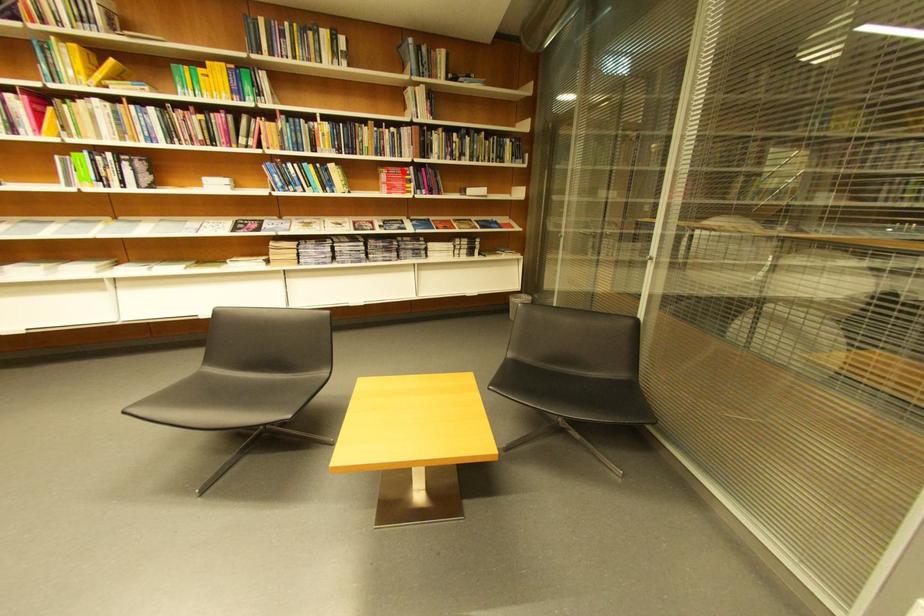
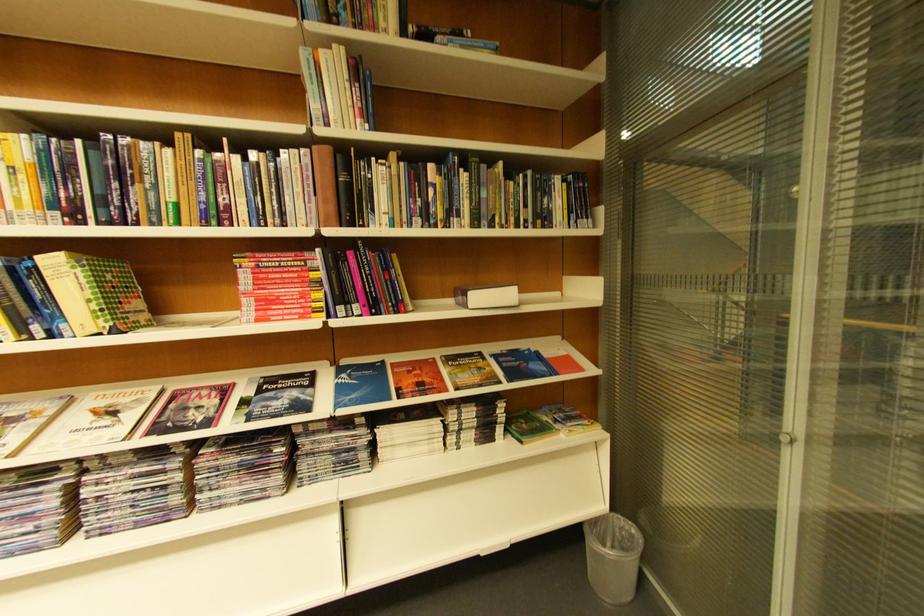
Question: A red point is marked in image1. In image2, is the corresponding 3D point closer to the camera or farther? Reply with the corresponding letter.

Choices:
 (A) The corresponding 3D point is closer.
 (B) The corresponding 3D point is farther.

Answer: (B)